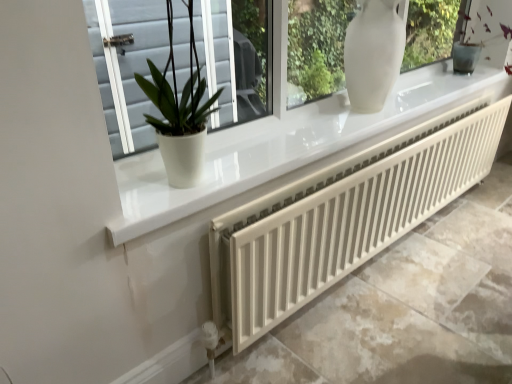
Question: Considering the relative positions of white glossy pot at left and white matte radiator at lower center in the image provided, is white glossy pot at left to the left or to the right of white matte radiator at lower center?

Choices:
 (A) left
 (B) right

Answer: (A)

Question: Is white glossy pot at left bigger or smaller than white matte radiator at lower center?

Choices:
 (A) big
 (B) small

Answer: (B)

Question: Is white glossy pot at left taller or shorter than white matte radiator at lower center?

Choices:
 (A) tall
 (B) short

Answer: (B)

Question: From a real-world perspective, is white matte radiator at lower center physically located above or below white glossy pot at left?

Choices:
 (A) below
 (B) above

Answer: (A)

Question: Considering the positions of white matte radiator at lower center and white glossy pot at left in the image, is white matte radiator at lower center wider or thinner than white glossy pot at left?

Choices:
 (A) wide
 (B) thin

Answer: (B)

Question: Considering the positions of white matte radiator at lower center and white glossy pot at left in the image, is white matte radiator at lower center bigger or smaller than white glossy pot at left?

Choices:
 (A) small
 (B) big

Answer: (B)

Question: From their relative heights in the image, would you say white matte radiator at lower center is taller or shorter than white glossy pot at left?

Choices:
 (A) short
 (B) tall

Answer: (B)